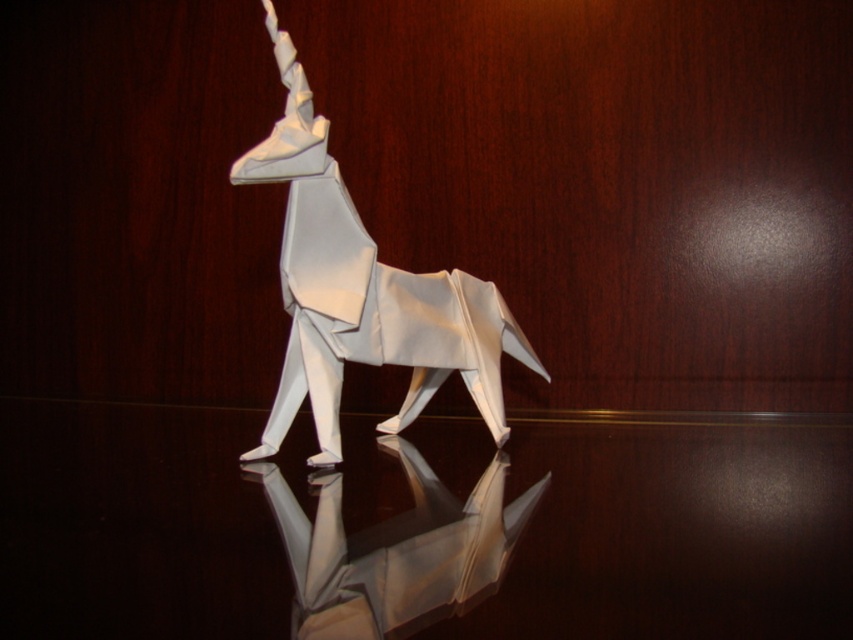
Question: Which of the following is the farthest from the observer?

Choices:
 (A) white paper origami at center
 (B) white paper origami deer at center

Answer: (B)

Question: Does white paper origami deer at center have a larger size compared to white paper origami at center?

Choices:
 (A) yes
 (B) no

Answer: (A)

Question: Does white paper origami deer at center appear on the right side of white paper origami at center?

Choices:
 (A) yes
 (B) no

Answer: (B)

Question: Which point appears farthest from the camera in this image?

Choices:
 (A) (407, 298)
 (B) (349, 548)

Answer: (A)

Question: Which point is closer to the camera?

Choices:
 (A) white paper origami deer at center
 (B) white paper origami at center

Answer: (B)

Question: Can you confirm if white paper origami deer at center is positioned to the left of white paper origami at center?

Choices:
 (A) yes
 (B) no

Answer: (A)